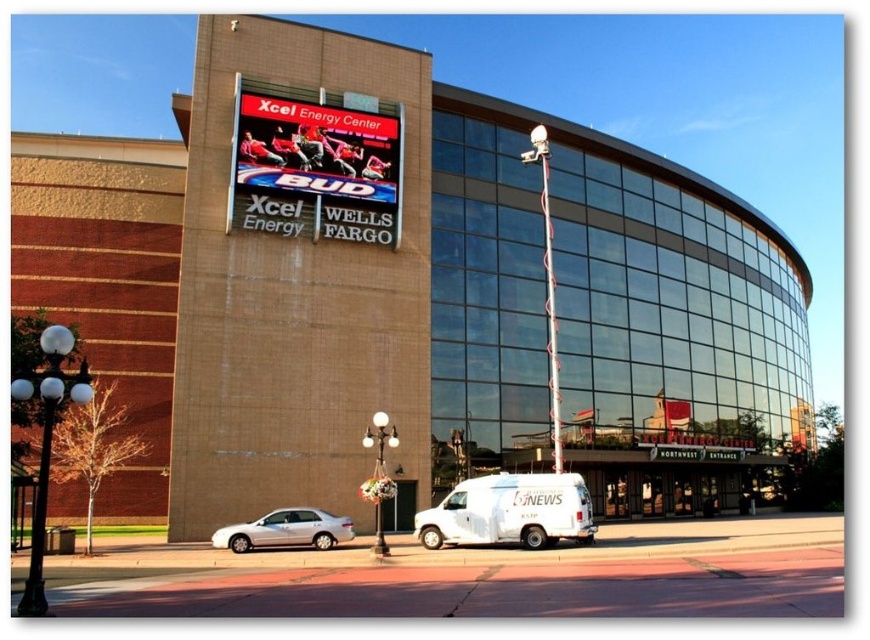
You are a delivery driver who needs to park your truck between the silver metallic sedan at lower left and the metallic spiral pole at upper center. The truck requires 20 feet of space. Is there enough space between them?

The distance between the silver metallic sedan at lower left and the metallic spiral pole at upper center is 69.83 feet, which is more than enough to accommodate the truck requiring 20 feet of space.

You are a photographer standing on the sidewalk in front of the Xcel Energy Center. You want to take a photo that includes both the silver metallic sedan at lower left and the metallic spiral pole at upper center. Which object should you position closer to the left edge of your camera frame?

The silver metallic sedan at lower left should be positioned closer to the left edge of your camera frame because it is already on the left side of the metallic spiral pole at upper center.